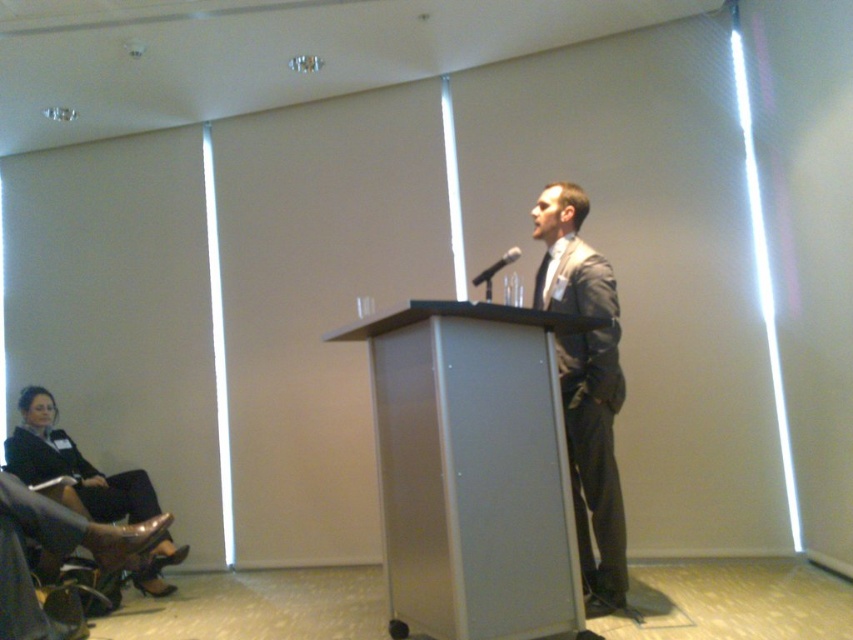
You are an event planner organizing a seating arrangement for an upcoming conference. You need to place a 1.2 meter wide table between the matte gray suit at center and the matte black suit at lower left. Will there be enough space between them to fit the table?

The matte gray suit at center is taller than the matte black suit at lower left, but this information does not provide details about the horizontal distance between them. Therefore, it is unclear if there is enough space to fit a 1.2 meter wide table between them.

You are a photographer in the conference room. You need to position a camera to capture both the matte black suit at lower left and the black matte microphone at center. Based on their positions, which object is closer to the left side of the frame?

The matte black suit at lower left is closer to the left side of the frame since it is positioned to the left of the black matte microphone at center.

You are attending a conference and notice two attendees dressed in suits. The first is wearing a matte gray suit at center, and the second is wearing a matte black suit at lower left. Based on their positions, which attendee is standing higher in the room?

The matte gray suit at center is above the matte black suit at lower left, so the attendee wearing the matte gray suit at center is standing higher in the room.